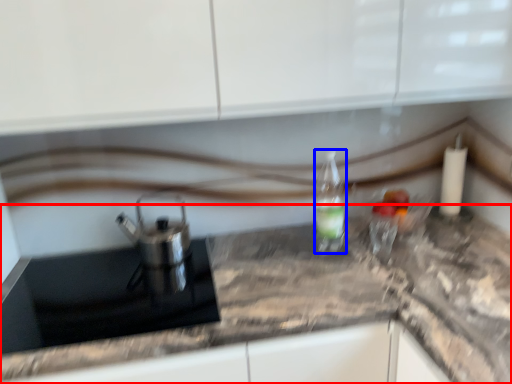
Question: Among these objects, which one is farthest to the camera, countertop (highlighted by a red box) or bottle (highlighted by a blue box)?

Choices:
 (A) countertop
 (B) bottle

Answer: (B)